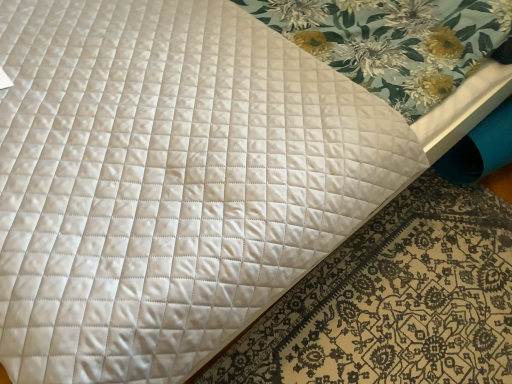
What do you see at coordinates (393, 301) in the screenshot? This screenshot has height=384, width=512. I see `white quilted mat at center` at bounding box center [393, 301].

This screenshot has height=384, width=512. In order to click on white quilted mat at center in this screenshot , I will do tap(393, 301).

In order to click on white quilted mat at center in this screenshot , I will do `click(393, 301)`.